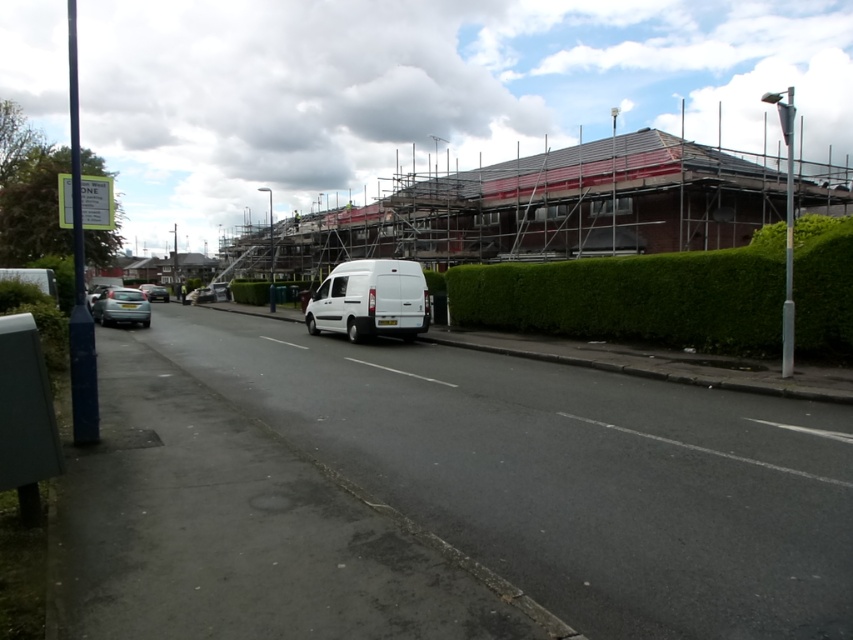
Is green leafy hedge at center to the right of silver metallic car at center from the viewer's perspective?

Indeed, green leafy hedge at center is positioned on the right side of silver metallic car at center.

Does point (651, 321) come farther from viewer compared to point (164, 298)?

No, it is not.

What do you see at coordinates (635, 298) in the screenshot? I see `green leafy hedge at center` at bounding box center [635, 298].

Locate an element on the screen. The width and height of the screenshot is (853, 640). green leafy hedge at center is located at coordinates (635, 298).

Can you confirm if green leafy hedge at center is wider than white matte van at center?

Yes, green leafy hedge at center is wider than white matte van at center.

Which is behind, point (689, 273) or point (323, 278)?

The point (323, 278) is behind.

This screenshot has height=640, width=853. Identify the location of green leafy hedge at center. (635, 298).

Consider the image. Is white matte van at center above metallic silver car at lower left?

Correct, white matte van at center is located above metallic silver car at lower left.

Does white matte van at center have a smaller size compared to metallic silver car at lower left?

Yes, white matte van at center is smaller than metallic silver car at lower left.

I want to click on white matte van at center, so click(370, 300).